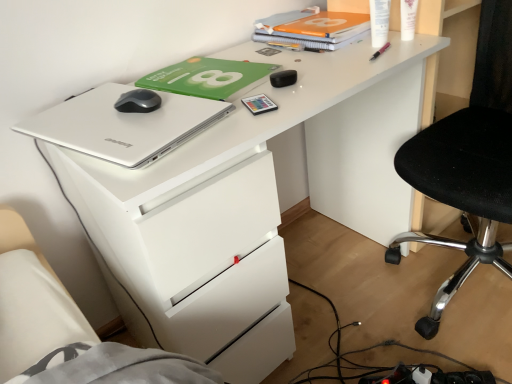
Identify the location of free space between orange matte notebook at upper center and black matte earbuds at center, the fourth stationery viewed from the top. This screenshot has width=512, height=384. (296, 55).